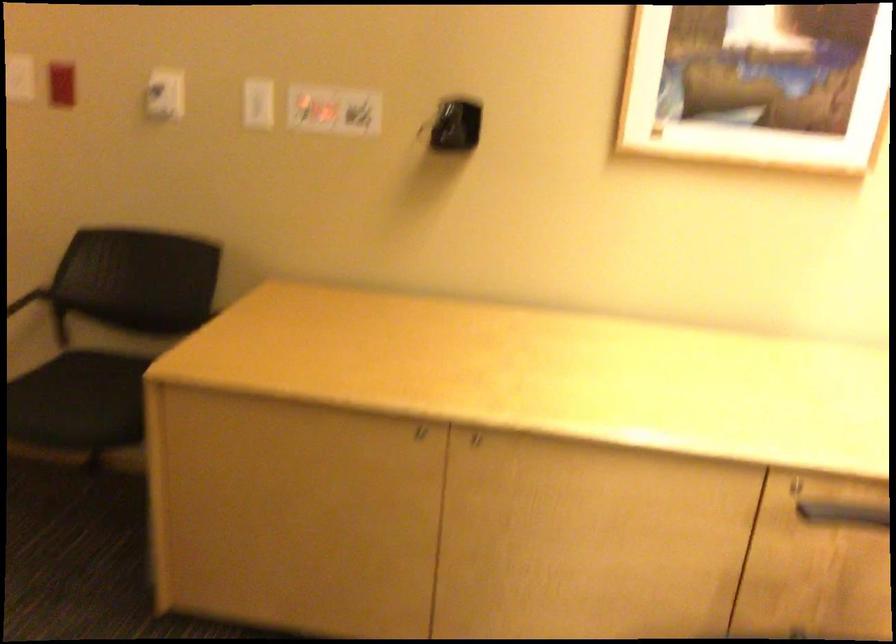
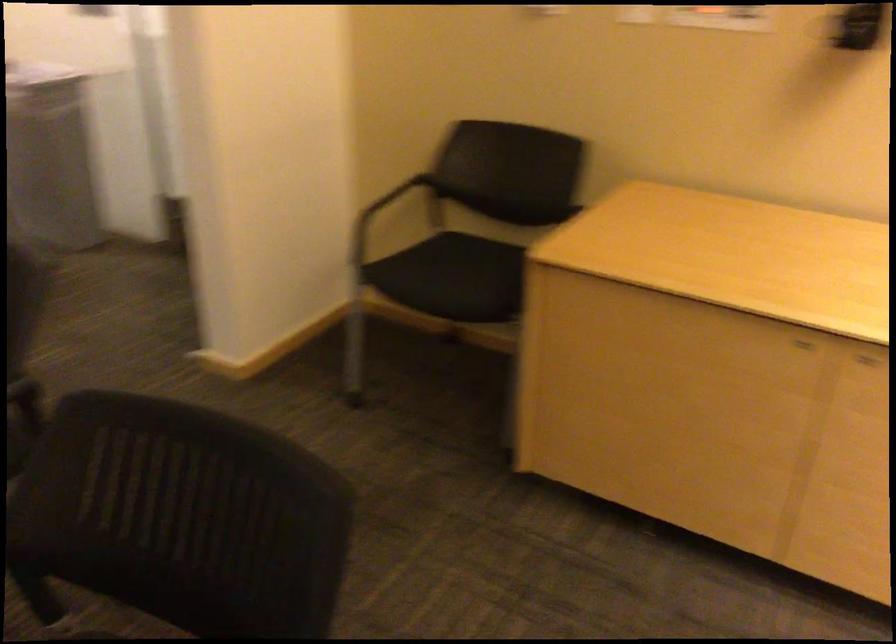
The point at (x=71, y=412) is marked in the first image. Where is the corresponding point in the second image?

(446, 275)